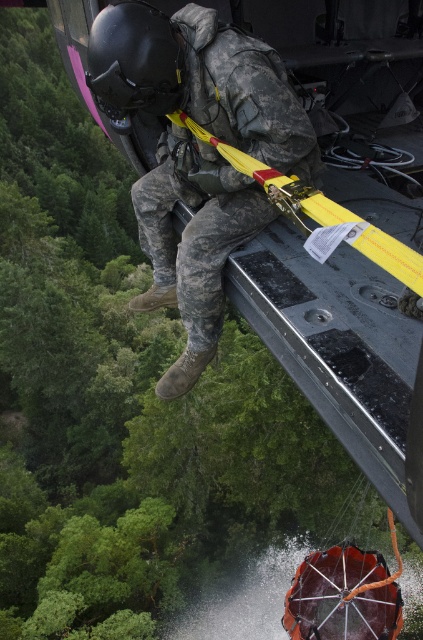
Question: Does camouflage fabric soldier at center lie behind black matte helmet at upper left?

Choices:
 (A) yes
 (B) no

Answer: (A)

Question: Which of the following is the farthest from the observer?

Choices:
 (A) camouflage fabric soldier at center
 (B) black matte helmet at upper left

Answer: (A)

Question: Does camouflage fabric soldier at center have a lesser width compared to black matte helmet at upper left?

Choices:
 (A) no
 (B) yes

Answer: (A)

Question: Can you confirm if camouflage fabric soldier at center is positioned below black matte helmet at upper left?

Choices:
 (A) no
 (B) yes

Answer: (B)